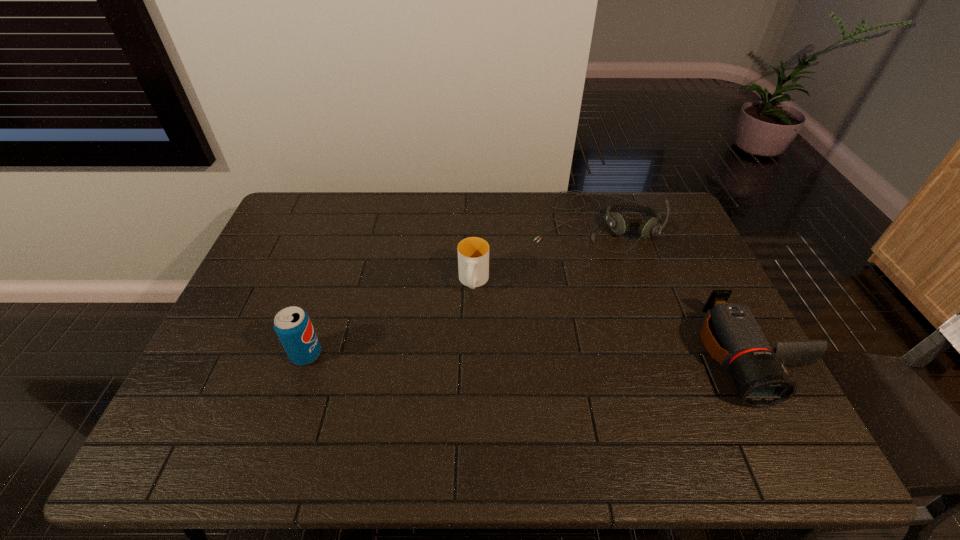
In the image, there is a desktop. Where is `free space at the near edge`? free space at the near edge is located at coordinates (x=406, y=397).

Find the location of a particular element. vacant space at the left edge of the desktop is located at coordinates (296, 253).

This screenshot has height=540, width=960. What are the coordinates of `free space at the right edge of the desktop` in the screenshot? It's located at (707, 279).

Find the location of a particular element. free spot between the farthest object and the third object from right to left is located at coordinates (534, 251).

At what (x,y) coordinates should I click in order to perform the action: click on vacant area that lies between the third object from right to left and the farthest object. Please return your answer as a coordinate pair (x, y). Looking at the image, I should click on (534, 251).

Find the location of a particular element. free area in between the headset and the tallest object is located at coordinates (450, 287).

Identify the location of free space between the headset and the cup. This screenshot has width=960, height=540. (534, 251).

Find the location of `unoccupied position between the second farthest object and the soda can`. unoccupied position between the second farthest object and the soda can is located at coordinates (390, 319).

Identify the location of free spot between the tallest object and the camcorder. (528, 355).

You are a GUI agent. You are given a task and a screenshot of the screen. Output one action in this format:
    pyautogui.click(x=<x>, y=<y>)
    Task: Click on the free area in between the headset and the camcorder
    
    Given the screenshot: What is the action you would take?
    pyautogui.click(x=672, y=288)